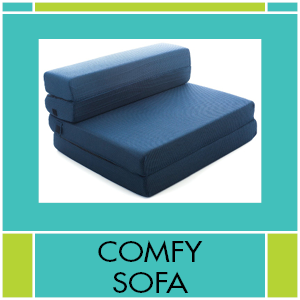
Find the location of a particular element. This screenshot has height=300, width=300. seat is located at coordinates (175, 117).